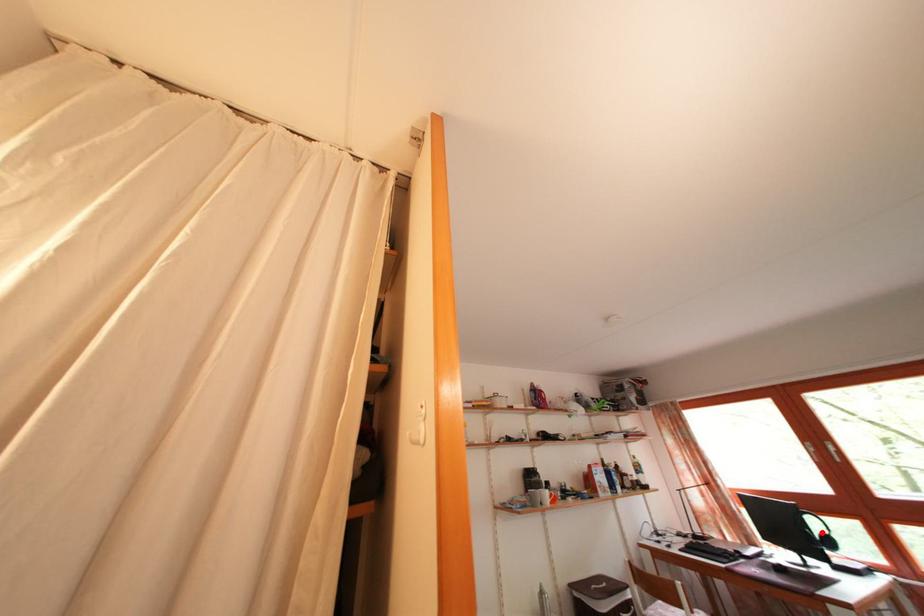
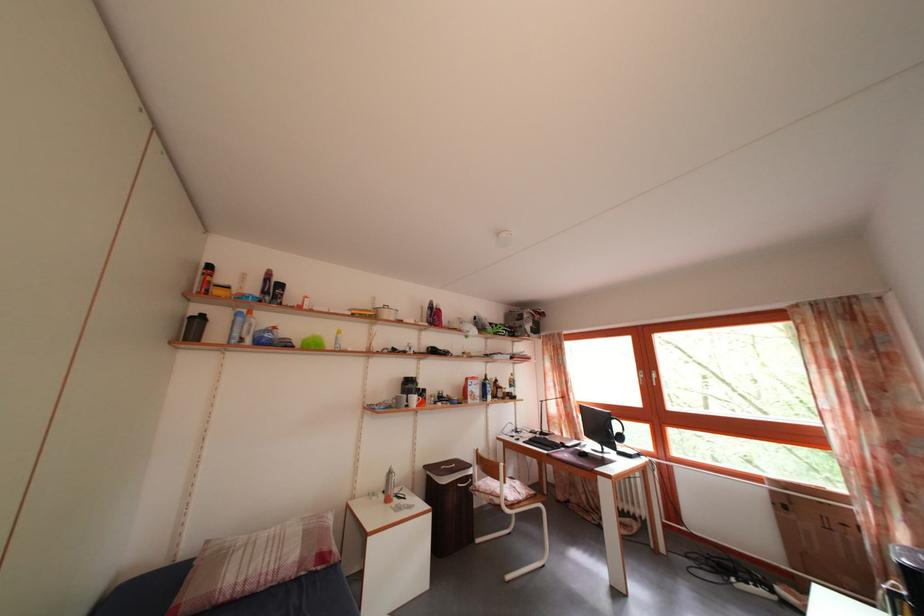
Question: I am providing you with two images of the same scene from different viewpoints. In image1, a red point is highlighted. Considering the same 3D point in image2, which of the following is correct?

Choices:
 (A) It is closer
 (B) It is farther

Answer: (B)